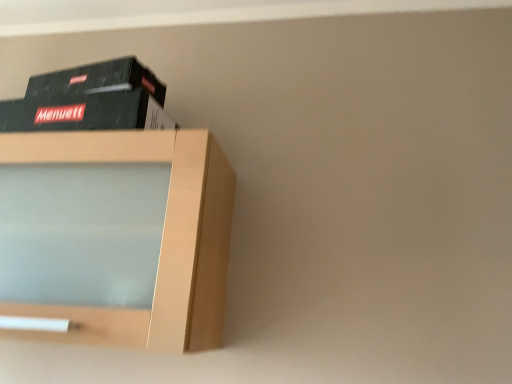
The image size is (512, 384). What are the coordinates of `light wood shelf at upper left` in the screenshot? It's located at (116, 236).

The height and width of the screenshot is (384, 512). What do you see at coordinates (116, 236) in the screenshot? I see `light wood shelf at upper left` at bounding box center [116, 236].

Find the location of a particular element. The image size is (512, 384). black matte book at upper left is located at coordinates pyautogui.click(x=89, y=99).

The image size is (512, 384). What do you see at coordinates (89, 99) in the screenshot?
I see `black matte book at upper left` at bounding box center [89, 99].

Find the location of a particular element. Image resolution: width=512 pixels, height=384 pixels. light wood shelf at upper left is located at coordinates (116, 236).

Which is more to the left, black matte book at upper left or light wood shelf at upper left?

light wood shelf at upper left is more to the left.

Based on the photo, in the image, is black matte book at upper left positioned in front of or behind light wood shelf at upper left?

Visually, black matte book at upper left is located behind light wood shelf at upper left.

Is point (45, 77) positioned in front of point (177, 153)?

No.

From the image's perspective, does black matte book at upper left appear lower than light wood shelf at upper left?

No, from the image's perspective, black matte book at upper left is not below light wood shelf at upper left.

From a real-world perspective, is black matte book at upper left located beneath light wood shelf at upper left?

No, from a real-world perspective, black matte book at upper left is not beneath light wood shelf at upper left.

From the picture: Does black matte book at upper left have a greater width compared to light wood shelf at upper left?

In fact, black matte book at upper left might be narrower than light wood shelf at upper left.

Between black matte book at upper left and light wood shelf at upper left, which one has less height?

black matte book at upper left is shorter.

From the picture: Who is bigger, black matte book at upper left or light wood shelf at upper left?

light wood shelf at upper left.

Is black matte book at upper left located outside light wood shelf at upper left?

black matte book at upper left lies outside light wood shelf at upper left's area.

Is black matte book at upper left in contact with light wood shelf at upper left?

No.

Is black matte book at upper left oriented away from light wood shelf at upper left?

black matte book at upper left does not have its back to light wood shelf at upper left.

What's the angular difference between black matte book at upper left and light wood shelf at upper left's facing directions?

The facing directions of black matte book at upper left and light wood shelf at upper left are 5.04 degrees apart.

Measure the distance from black matte book at upper left to light wood shelf at upper left.

black matte book at upper left and light wood shelf at upper left are 16.86 centimeters apart.

Find the location of a particular element. This screenshot has height=384, width=512. book on the right of light wood shelf at upper left is located at coordinates (89, 99).

Considering the relative positions of light wood shelf at upper left and black matte book at upper left in the image provided, is light wood shelf at upper left to the right of black matte book at upper left from the viewer's perspective?

Incorrect, light wood shelf at upper left is not on the right side of black matte book at upper left.

Who is more distant, light wood shelf at upper left or black matte book at upper left?

black matte book at upper left.

Is point (177, 325) in front of point (127, 94)?

That is True.

From the image's perspective, is light wood shelf at upper left positioned above or below black matte book at upper left?

light wood shelf at upper left is below black matte book at upper left.

From a real-world perspective, is light wood shelf at upper left beneath black matte book at upper left?

Indeed, from a real-world perspective, light wood shelf at upper left is positioned beneath black matte book at upper left.

Looking at this image, which of these two, light wood shelf at upper left or black matte book at upper left, is thinner?

black matte book at upper left.

Considering the relative sizes of light wood shelf at upper left and black matte book at upper left in the image provided, is light wood shelf at upper left shorter than black matte book at upper left?

No.

Between light wood shelf at upper left and black matte book at upper left, which one has smaller size?

black matte book at upper left is smaller.

Is light wood shelf at upper left located outside black matte book at upper left?

Indeed, light wood shelf at upper left is completely outside black matte book at upper left.

Is light wood shelf at upper left with black matte book at upper left?

No, light wood shelf at upper left is not with black matte book at upper left.

Could you tell me if light wood shelf at upper left is facing black matte book at upper left?

No, light wood shelf at upper left does not turn towards black matte book at upper left.

Identify the location of shelf in front of the black matte book at upper left. (116, 236).

Find the location of `shelf in front of the black matte book at upper left`. shelf in front of the black matte book at upper left is located at coordinates (116, 236).

Where is `book lying above the light wood shelf at upper left (from the image's perspective)`? book lying above the light wood shelf at upper left (from the image's perspective) is located at coordinates (89, 99).